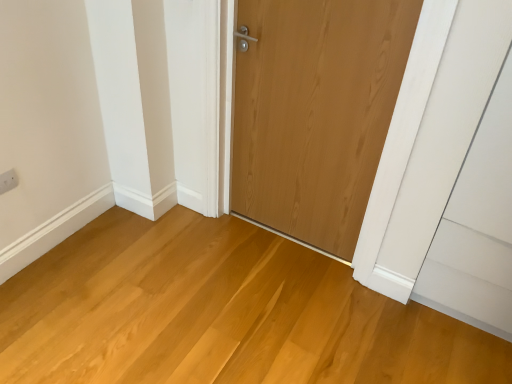
Question: Is natural wood door at center wider or thinner than white plastic electric outlet at upper left?

Choices:
 (A) wide
 (B) thin

Answer: (A)

Question: Considering the positions of point (394, 79) and point (11, 173), is point (394, 79) closer or farther from the camera than point (11, 173)?

Choices:
 (A) closer
 (B) farther

Answer: (A)

Question: Based on their relative distances, which object is nearer to the natural wood door at center?

Choices:
 (A) white plastic electric outlet at upper left
 (B) natural wood floor at center

Answer: (B)

Question: Based on their relative distances, which object is nearer to the white plastic electric outlet at upper left?

Choices:
 (A) natural wood door at center
 (B) natural wood floor at center

Answer: (B)